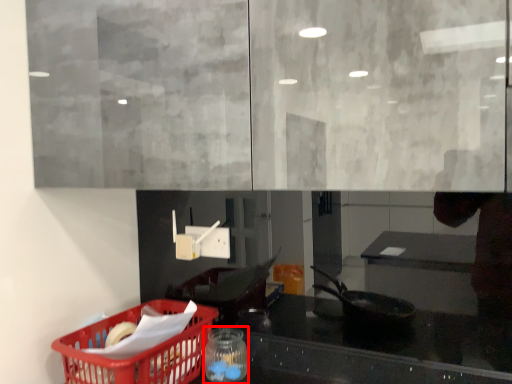
Question: From the image's perspective, where is glass jar (annotated by the red box) located relative to basket?

Choices:
 (A) above
 (B) below

Answer: (A)